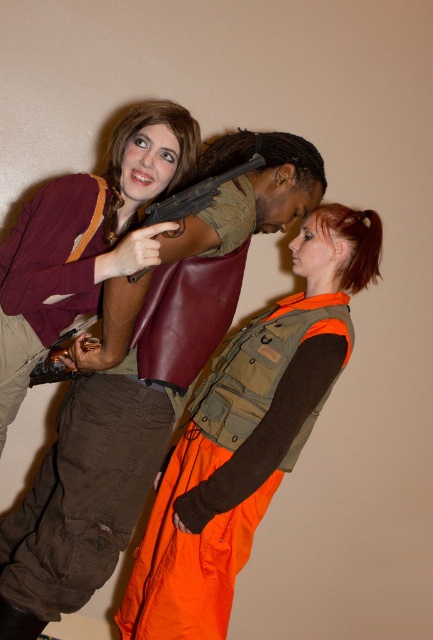
Question: Considering the relative positions of orange fabric vest at center and matte black shotgun at center in the image provided, where is orange fabric vest at center located with respect to matte black shotgun at center?

Choices:
 (A) right
 (B) left

Answer: (A)

Question: Is orange fabric vest at center closer to camera compared to matte black shotgun at center?

Choices:
 (A) no
 (B) yes

Answer: (A)

Question: Which object is the farthest from the orange fabric vest at center?

Choices:
 (A) matte black shotgun at center
 (B) matte brown leather jacket at upper left

Answer: (A)

Question: Among these points, which one is nearest to the camera?

Choices:
 (A) click(184, 193)
 (B) click(19, 324)

Answer: (A)

Question: Is orange fabric vest at center smaller than matte black shotgun at center?

Choices:
 (A) yes
 (B) no

Answer: (B)

Question: Which point appears closest to the camera in this image?

Choices:
 (A) (36, 212)
 (B) (236, 538)
 (C) (170, 214)

Answer: (C)